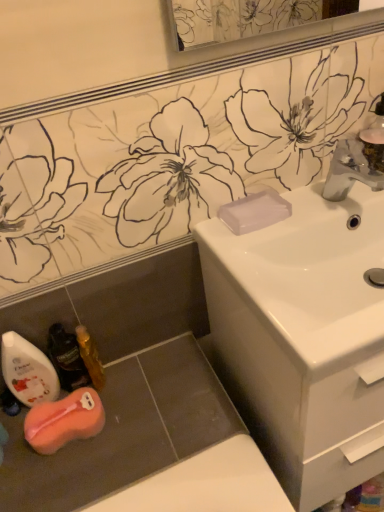
Question: In terms of height, does white glossy mouthwash at lower left, the third mouthwash positioned from the right, look taller or shorter compared to translucent plastic mouthwash at lower left, marked as the 2th mouthwash in a left-to-right arrangement?

Choices:
 (A) short
 (B) tall

Answer: (B)

Question: From the image's perspective, relative to translucent plastic mouthwash at lower left, positioned as the 2th mouthwash in right-to-left order, is white glossy mouthwash at lower left, the 1th mouthwash positioned from the left, above or below?

Choices:
 (A) below
 (B) above

Answer: (A)

Question: Considering the real-world distances, which object is farthest from the orange sponge at lower left?

Choices:
 (A) white glossy sink at center
 (B) gold metallic mouthwash at lower left, which is counted as the third mouthwash, starting from the left
 (C) transparent plastic soap at sink right
 (D) white glossy mouthwash at lower left, the 1th mouthwash positioned from the left
 (E) satin nickel faucet at upper right

Answer: (E)

Question: Which object is positioned farthest from the satin nickel faucet at upper right?

Choices:
 (A) orange sponge at lower left
 (B) translucent plastic mouthwash at lower left, marked as the 2th mouthwash in a left-to-right arrangement
 (C) transparent plastic soap at sink right
 (D) gold metallic mouthwash at lower left, which is counted as the third mouthwash, starting from the left
 (E) white glossy mouthwash at lower left, the third mouthwash positioned from the right

Answer: (E)